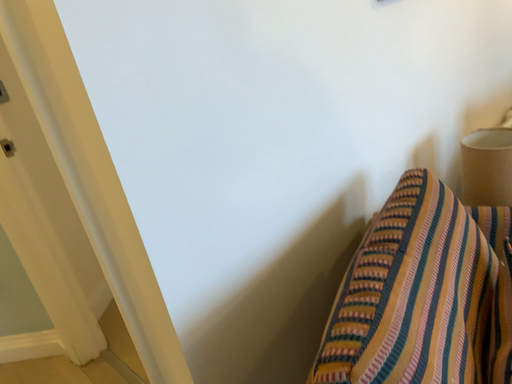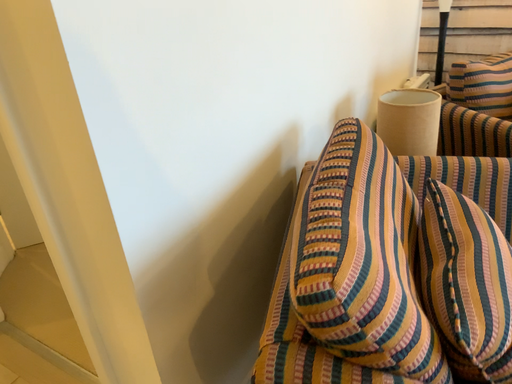
Question: How did the camera likely rotate when shooting the video?

Choices:
 (A) rotated right
 (B) rotated left

Answer: (A)